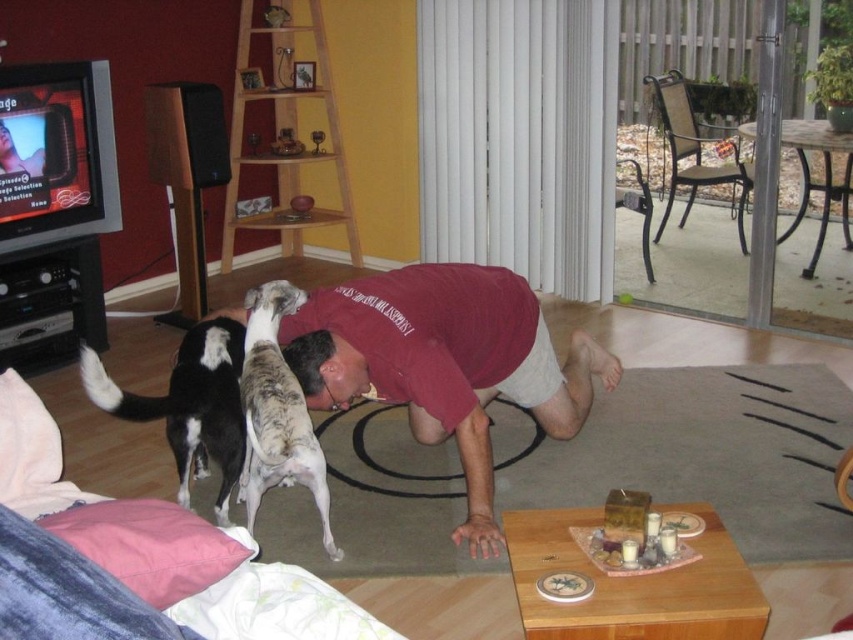
Question: Does maroon fabric squat at center appear over black and white fur at lower left?

Choices:
 (A) no
 (B) yes

Answer: (A)

Question: Which object is closer to the camera taking this photo?

Choices:
 (A) maroon fabric squat at center
 (B) speckled fur dog at center

Answer: (B)

Question: Is maroon fabric squat at center further to the viewer compared to black and white fur at lower left?

Choices:
 (A) no
 (B) yes

Answer: (B)

Question: From the image, what is the correct spatial relationship of maroon fabric squat at center in relation to black and white fur at lower left?

Choices:
 (A) above
 (B) below

Answer: (B)

Question: Which point appears closest to the camera in this image?

Choices:
 (A) (128, 408)
 (B) (364, 387)
 (C) (291, 308)

Answer: (A)

Question: Which point is farther to the camera?

Choices:
 (A) (373, 371)
 (B) (288, 298)
 (C) (216, 433)

Answer: (C)